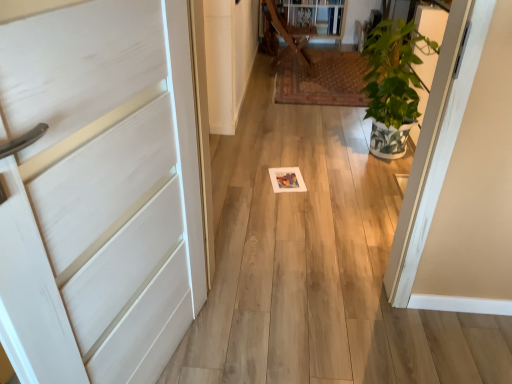
Question: Is white matte door at left next to wooden at center?

Choices:
 (A) yes
 (B) no

Answer: (B)

Question: Is white matte door at left at the left side of wooden at center?

Choices:
 (A) yes
 (B) no

Answer: (A)

Question: Considering the relative sizes of white matte door at left and wooden at center in the image provided, is white matte door at left smaller than wooden at center?

Choices:
 (A) no
 (B) yes

Answer: (B)

Question: Is white matte door at left positioned before wooden at center?

Choices:
 (A) no
 (B) yes

Answer: (B)

Question: From the image's perspective, is white matte door at left under wooden at center?

Choices:
 (A) no
 (B) yes

Answer: (B)

Question: Is white matte door at left facing towards wooden at center?

Choices:
 (A) no
 (B) yes

Answer: (A)

Question: Can you confirm if white matte door at left is bigger than green leafy plant at right?

Choices:
 (A) no
 (B) yes

Answer: (A)

Question: Is white matte door at left positioned far away from green leafy plant at right?

Choices:
 (A) no
 (B) yes

Answer: (B)

Question: Is white matte door at left to the right of green leafy plant at right from the viewer's perspective?

Choices:
 (A) yes
 (B) no

Answer: (B)

Question: Does white matte door at left appear on the left side of green leafy plant at right?

Choices:
 (A) yes
 (B) no

Answer: (A)

Question: Considering the relative sizes of white matte door at left and green leafy plant at right in the image provided, is white matte door at left wider than green leafy plant at right?

Choices:
 (A) yes
 (B) no

Answer: (B)

Question: Is white matte door at left taller than green leafy plant at right?

Choices:
 (A) no
 (B) yes

Answer: (B)

Question: Is the position of wooden at center less distant than that of green leafy plant at right?

Choices:
 (A) yes
 (B) no

Answer: (B)